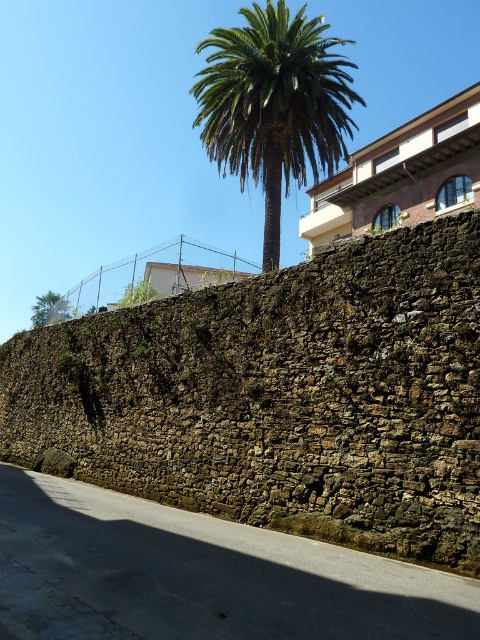
Who is shorter, green leafy palm at upper left or green leafy tree at upper center?

Standing shorter between the two is green leafy tree at upper center.

You are a GUI agent. You are given a task and a screenshot of the screen. Output one action in this format:
    pyautogui.click(x=<x>, y=<y>)
    Task: Click on the green leafy palm at upper left
    The image size is (480, 640).
    Given the screenshot: What is the action you would take?
    pyautogui.click(x=49, y=308)

Can you confirm if green leafy palm at upper center is positioned to the left of green leafy tree at upper center?

No, green leafy palm at upper center is not to the left of green leafy tree at upper center.

Does green leafy palm at upper center have a greater width compared to green leafy tree at upper center?

Indeed, green leafy palm at upper center has a greater width compared to green leafy tree at upper center.

Between point (337, 56) and point (154, 289), which one is positioned behind?

Point (154, 289)

I want to click on green leafy palm at upper center, so click(x=274, y=104).

Is the position of green leafy palm at upper center more distant than that of green leafy palm at upper left?

No, it is in front of green leafy palm at upper left.

Which is more to the left, green leafy palm at upper center or green leafy palm at upper left?

Positioned to the left is green leafy palm at upper left.

Who is more distant from viewer, (252,17) or (31,316)?

Positioned behind is point (31,316).

Locate an element on the screen. This screenshot has width=480, height=640. green leafy palm at upper center is located at coordinates (274, 104).